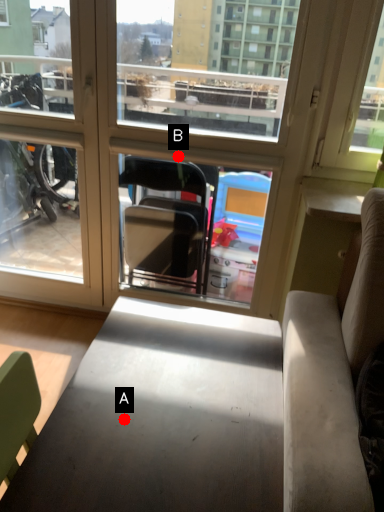
Question: Two points are circled on the image, labeled by A and B beside each circle. Which of the following is the farthest from the observer?

Choices:
 (A) A is further
 (B) B is further

Answer: (B)